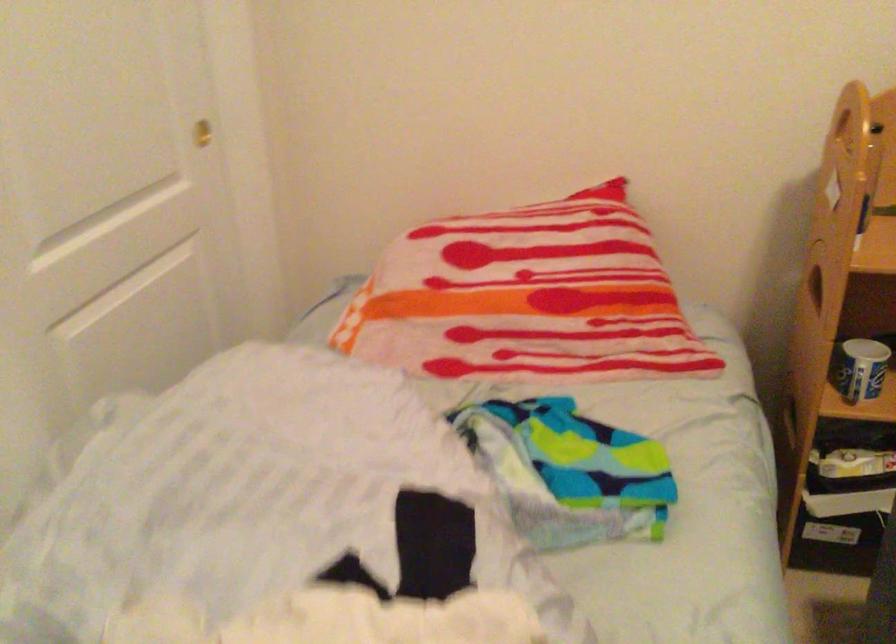
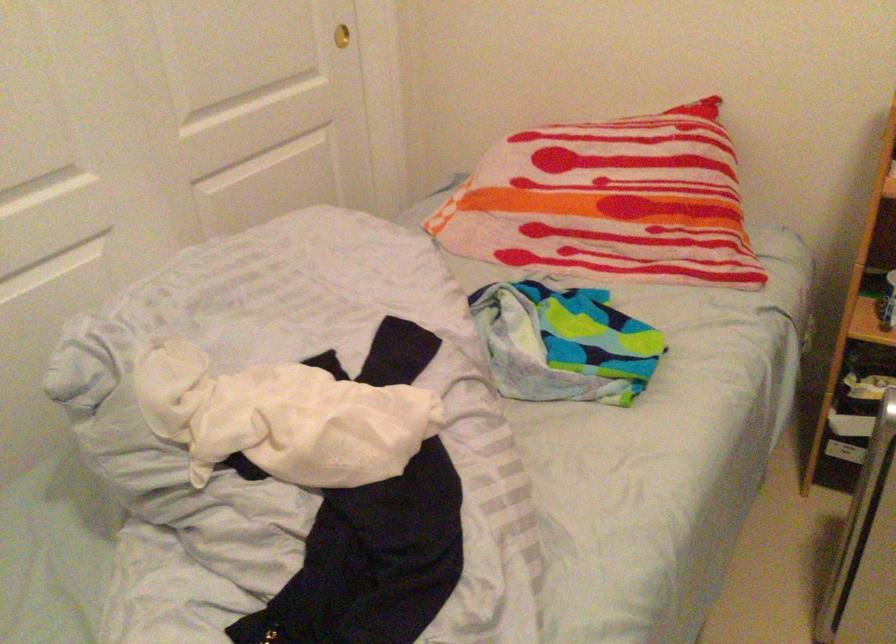
In the second image, find the point that corresponds to the point at 540,297 in the first image.

(608, 202)